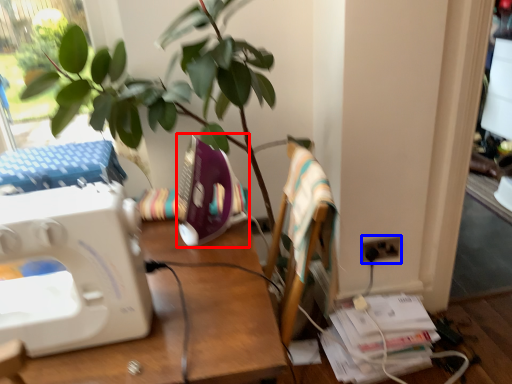
Question: Which object appears closest to the camera in this image, sewing machine (highlighted by a red box) or electric outlet (highlighted by a blue box)?

Choices:
 (A) sewing machine
 (B) electric outlet

Answer: (A)